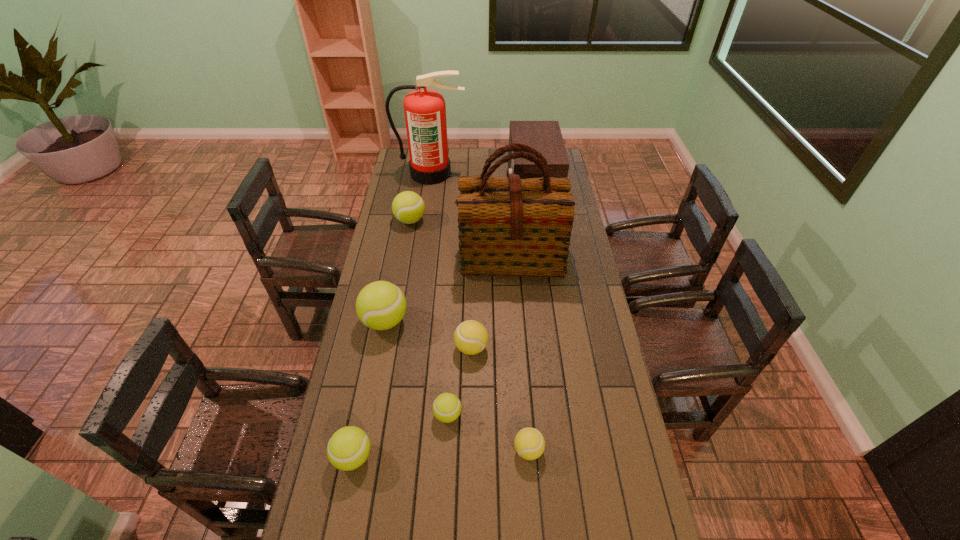
Where is `free point located on the back of the seventh nearest object`? This screenshot has width=960, height=540. free point located on the back of the seventh nearest object is located at coordinates (417, 186).

The width and height of the screenshot is (960, 540). In order to click on free space located on the back of the left yellow tennis ball in this screenshot , I will do `click(472, 299)`.

Find the location of `vacant area located on the back of the second smallest green tennis ball`. vacant area located on the back of the second smallest green tennis ball is located at coordinates (372, 360).

Where is `vacant space located on the left of the nearer yellow tennis ball`? This screenshot has height=540, width=960. vacant space located on the left of the nearer yellow tennis ball is located at coordinates (480, 450).

Identify the location of vacant space situated 0.290m on the left of the smallest green tennis ball. (342, 415).

At what (x,y) coordinates should I click in order to perform the action: click on fire extinguisher that is at the far edge. Please return your answer as a coordinate pair (x, y). The image size is (960, 540). Looking at the image, I should click on (425, 111).

Image resolution: width=960 pixels, height=540 pixels. Identify the location of radio receiver at the far edge. (544, 136).

Image resolution: width=960 pixels, height=540 pixels. I want to click on fire extinguisher located in the left edge section of the desktop, so click(x=425, y=111).

At what (x,y) coordinates should I click in order to perform the action: click on shopping bag at the right edge. Please return your answer as a coordinate pair (x, y). The width and height of the screenshot is (960, 540). Looking at the image, I should click on (509, 226).

Where is `radio receiver located in the right edge section of the desktop`? radio receiver located in the right edge section of the desktop is located at coordinates (544, 136).